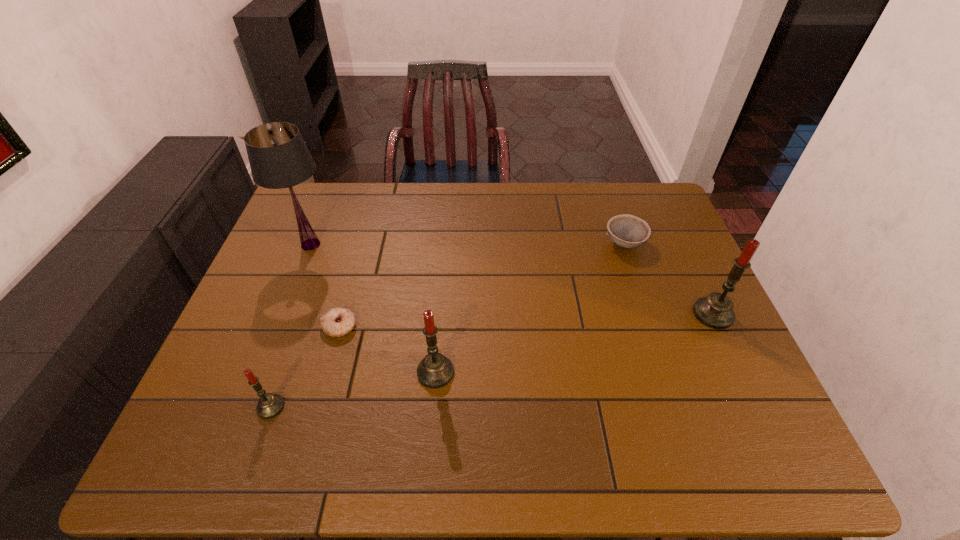
To make them evenly spaced by inserting another candle among them, please locate a free space for this new candle. Please provide its 2D coordinates. Your answer should be formatted as a tuple, i.e. [(x, y)], where the tuple contains the x and y coordinates of a point satisfying the conditions above.

[(582, 341)]